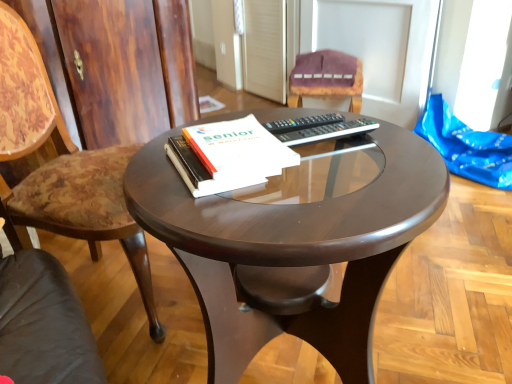
Question: Considering the relative sizes of wooden chair at left, which is the second chair from right to left, and white paper at center in the image provided, is wooden chair at left, which is the second chair from right to left, shorter than white paper at center?

Choices:
 (A) yes
 (B) no

Answer: (B)

Question: Is wooden chair at left, positioned as the first chair in left-to-right order, looking in the opposite direction of white paper at center?

Choices:
 (A) no
 (B) yes

Answer: (A)

Question: Considering the relative sizes of wooden chair at left, the first chair viewed from the front, and white paper at center in the image provided, is wooden chair at left, the first chair viewed from the front, thinner than white paper at center?

Choices:
 (A) no
 (B) yes

Answer: (A)

Question: Can you confirm if wooden chair at left, which is the 2th chair in back-to-front order, is positioned to the left of white paper at center?

Choices:
 (A) yes
 (B) no

Answer: (A)

Question: From the image's perspective, does wooden chair at left, which is the 2th chair in back-to-front order, appear higher than white paper at center?

Choices:
 (A) yes
 (B) no

Answer: (B)

Question: Is black plastic remote at center taller or shorter than white paper at center?

Choices:
 (A) short
 (B) tall

Answer: (A)

Question: Is point (365, 122) closer or farther from the camera than point (216, 125)?

Choices:
 (A) closer
 (B) farther

Answer: (B)

Question: Is black plastic remote at center inside the boundaries of white paper at center, or outside?

Choices:
 (A) inside
 (B) outside

Answer: (B)

Question: Would you say black plastic remote at center is to the left or to the right of white paper at center in the picture?

Choices:
 (A) right
 (B) left

Answer: (A)

Question: From the image's perspective, is glossy wood coffee table at center above or below black plastic remote at center?

Choices:
 (A) below
 (B) above

Answer: (A)

Question: Is glossy wood coffee table at center wider or thinner than black plastic remote at center?

Choices:
 (A) wide
 (B) thin

Answer: (A)

Question: Would you say glossy wood coffee table at center is to the left or to the right of black plastic remote at center in the picture?

Choices:
 (A) left
 (B) right

Answer: (A)

Question: Is glossy wood coffee table at center taller or shorter than black plastic remote at center?

Choices:
 (A) short
 (B) tall

Answer: (B)

Question: From a real-world perspective, is black plastic remote at center above or below wooden chair at left, positioned as the first chair in left-to-right order?

Choices:
 (A) below
 (B) above

Answer: (B)

Question: Does point [307, 137] appear closer or farther from the camera than point [4, 3]?

Choices:
 (A) closer
 (B) farther

Answer: (A)